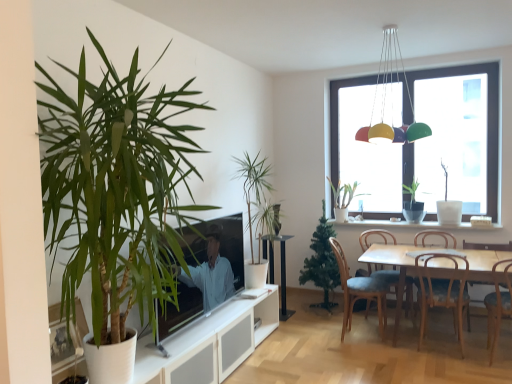
I want to click on free space in front of green matte christmas tree at center, the 4th houseplant when ordered from right to left, so click(x=317, y=324).